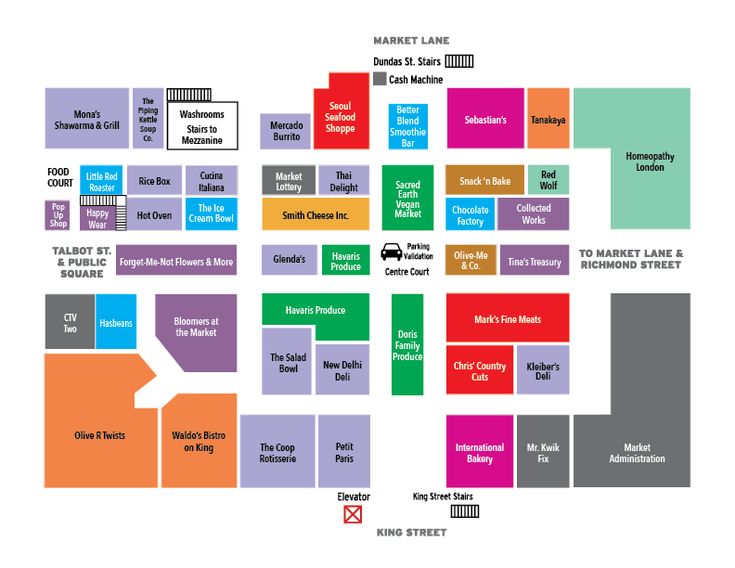
You are a GUI agent. You are given a task and a screenshot of the screen. Output one action in this format:
    pyautogui.click(x=<x>, y=<y>)
    Task: Click on the stairs
    The width and height of the screenshot is (735, 568).
    Given the screenshot: What is the action you would take?
    pyautogui.click(x=96, y=202), pyautogui.click(x=118, y=216), pyautogui.click(x=201, y=95), pyautogui.click(x=459, y=56), pyautogui.click(x=465, y=512)